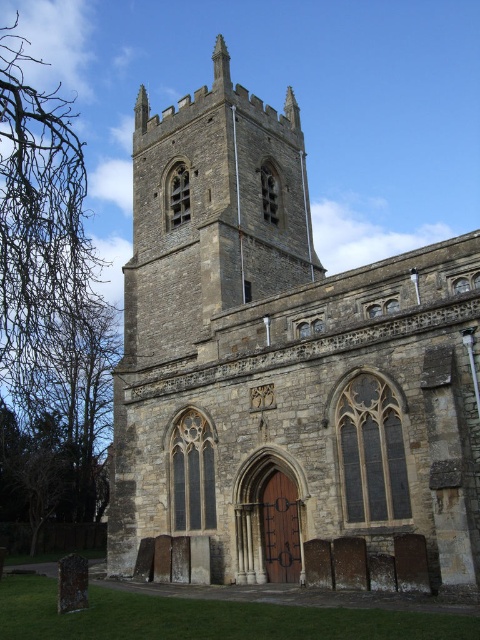
Question: Does stone church at center lie in front of stone tower at center?

Choices:
 (A) yes
 (B) no

Answer: (A)

Question: Is stone church at center thinner than stone tower at center?

Choices:
 (A) no
 (B) yes

Answer: (B)

Question: Which of the following is the closest to the observer?

Choices:
 (A) stone tower at center
 (B) stone church at center

Answer: (B)

Question: Does stone church at center have a larger size compared to stone tower at center?

Choices:
 (A) yes
 (B) no

Answer: (A)